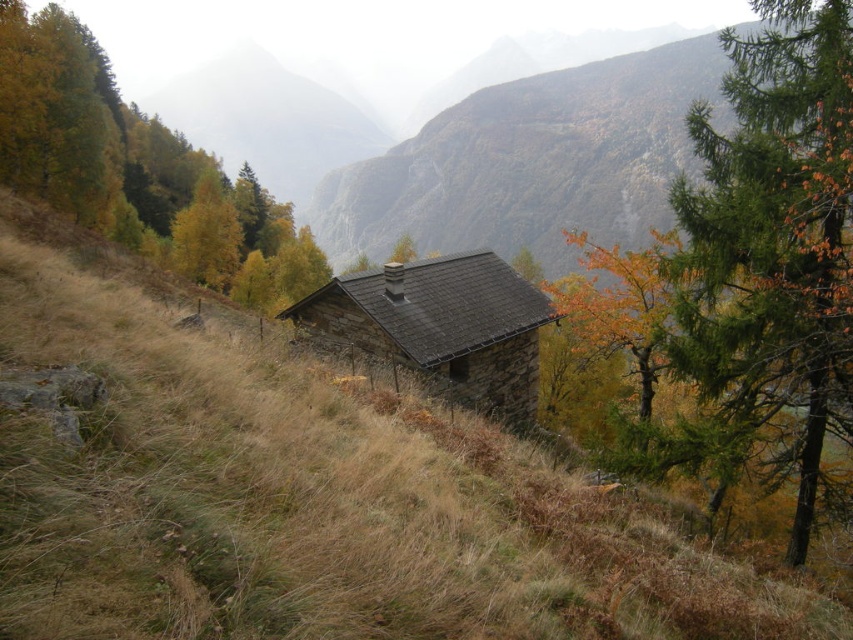
Is point (815, 406) behind point (312, 326)?

No, it is in front of (312, 326).

Does point (767, 13) come in front of point (474, 369)?

That is True.

Which is behind, point (572, 292) or point (300, 316)?

The point (572, 292) is more distant.

Find the location of a particular element. This screenshot has height=640, width=853. green needle-like tree at upper right is located at coordinates point(747,269).

Does brown grassy at center have a lesser height compared to green matte tree at center?

Correct, brown grassy at center is not as tall as green matte tree at center.

From the picture: Between brown grassy at center and green matte tree at center, which one has less height?

With less height is brown grassy at center.

Between point (373, 477) and point (235, 195), which one is positioned behind?

Point (235, 195)

This screenshot has height=640, width=853. I want to click on brown grassy at center, so click(x=306, y=493).

Does brown grassy at center have a lesser width compared to green needle-like tree at upper right?

Correct, brown grassy at center's width is less than green needle-like tree at upper right's.

Between brown grassy at center and green needle-like tree at upper right, which one appears on the left side from the viewer's perspective?

Positioned to the left is brown grassy at center.

Which is in front, point (90, 323) or point (741, 272)?

Point (90, 323) is in front.

The height and width of the screenshot is (640, 853). Find the location of `brown grassy at center`. brown grassy at center is located at coordinates (306, 493).